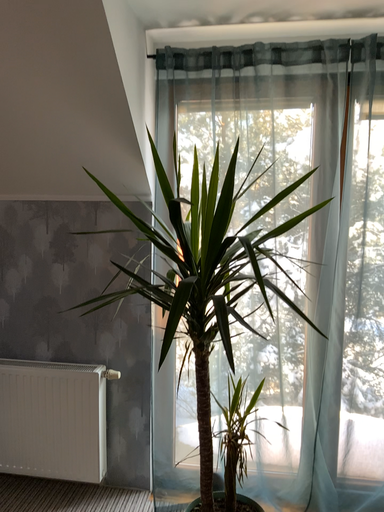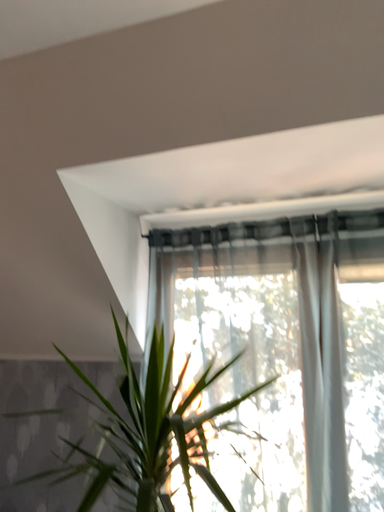
Question: Which way did the camera rotate in the video?

Choices:
 (A) rotated left
 (B) rotated right

Answer: (A)